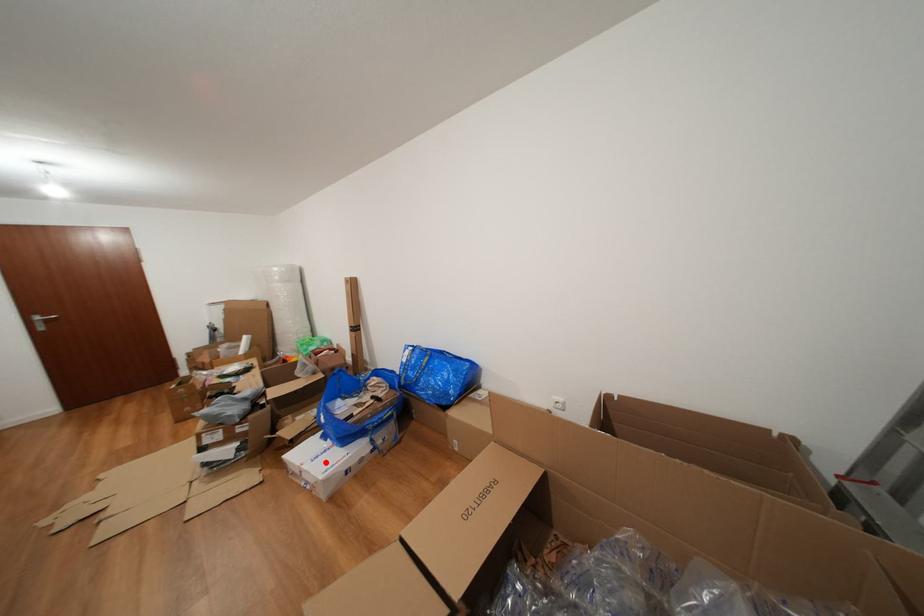
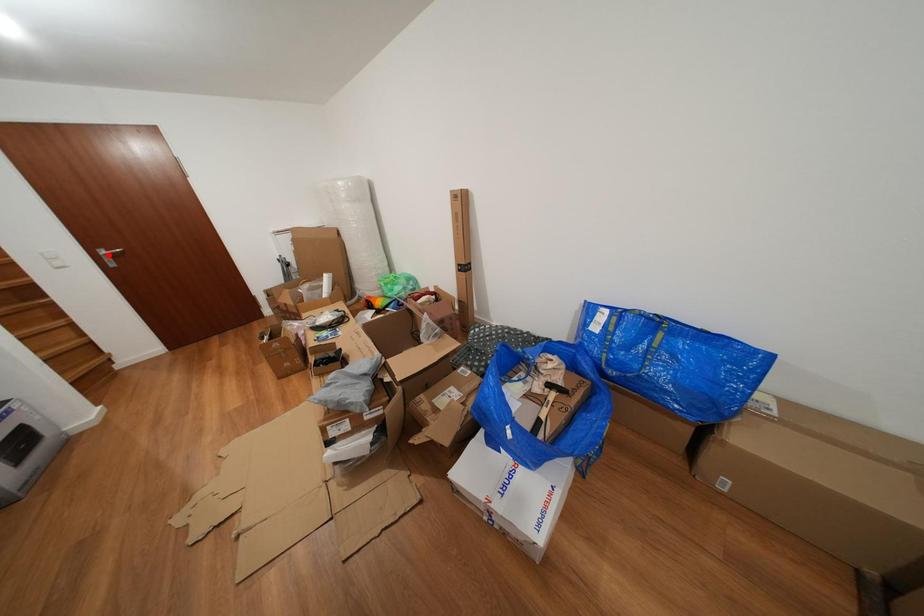
I am providing you with two images of the same scene from different viewpoints. A red point is marked on the first image and another point is marked on the second image. Does the point marked in image1 correspond to the same location as the one in image2?

No